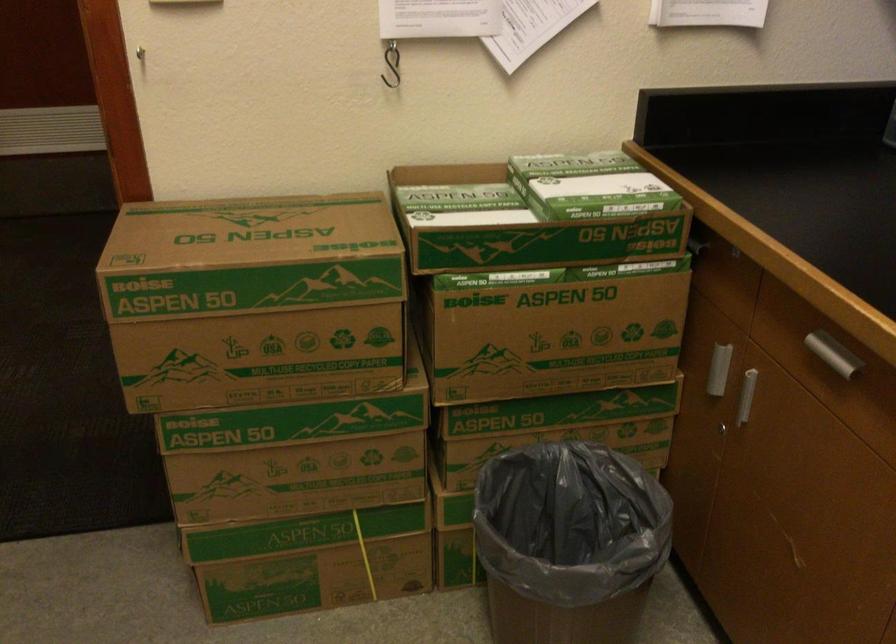
The images are taken continuously from a first-person perspective. In which direction is your viewpoint rotating?

The rotation direction of the camera is left-down.